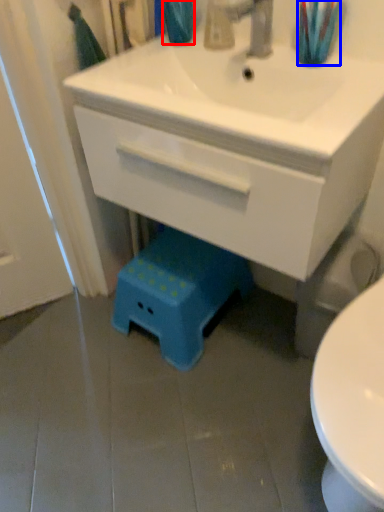
Question: Which object appears farthest to the camera in this image, teal (highlighted by a red box) or toothbrush (highlighted by a blue box)?

Choices:
 (A) teal
 (B) toothbrush

Answer: (A)